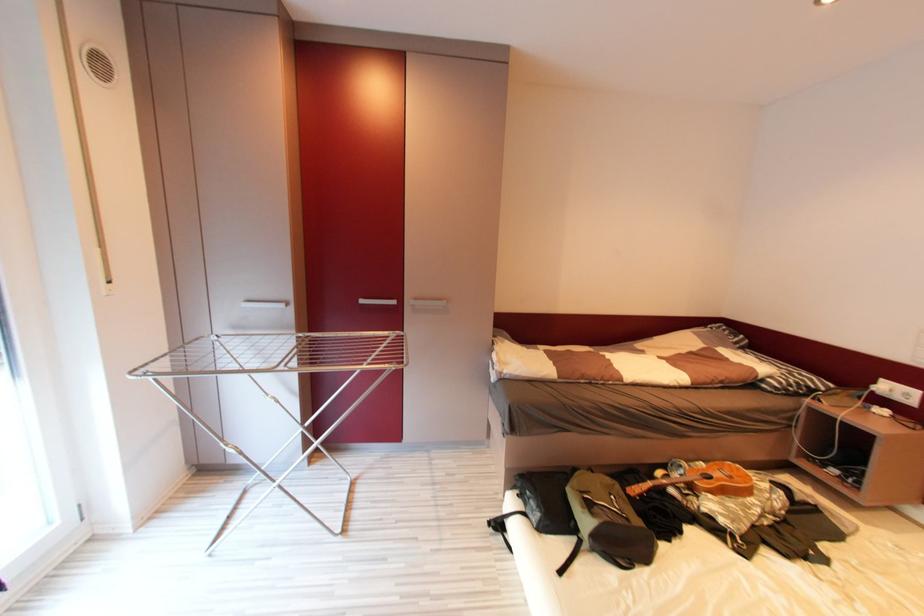
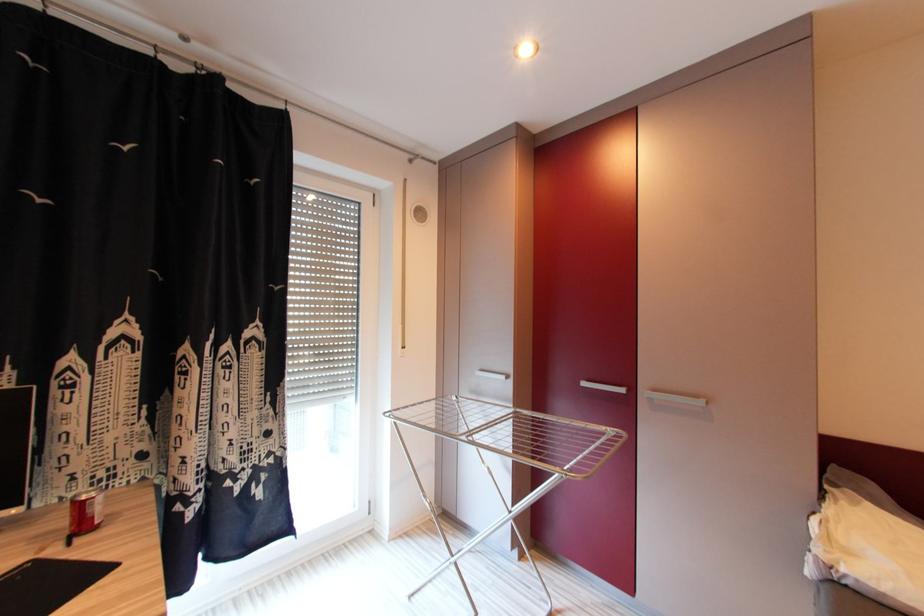
Question: The camera is either moving clockwise (left) or counter-clockwise (right) around the object. The first image is from the beginning of the video and the second image is from the end. Is the camera moving left or right when shooting the video?

Choices:
 (A) Left
 (B) Right

Answer: (B)